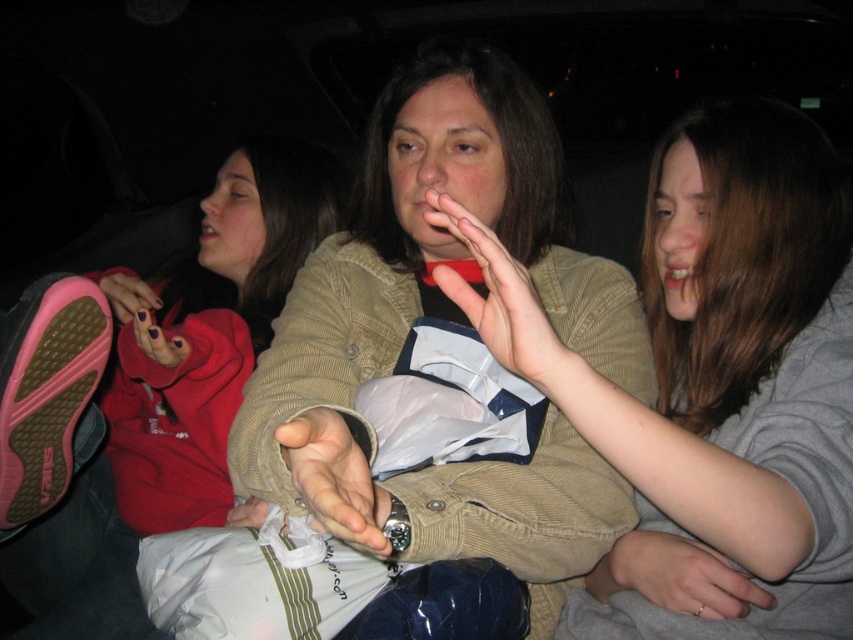
You are standing in front of the image and want to know how far the point at coordinates point (x=495, y=330) is from you. Can you determine the distance?

The point (x=495, y=330) is 27.38 inches away from the viewer.

You are a photographer trying to capture a closeup of the matte beige sweater at center and the silver metallic ring at lower right. Since you can only focus on one object at a time, which one should you point your camera towards first if you want to start with the object that is closer to the camera?

The silver metallic ring at lower right is closer to the camera because the matte beige sweater at center is to the right of it, implying spatial positioning where the ring is nearer in the frame.